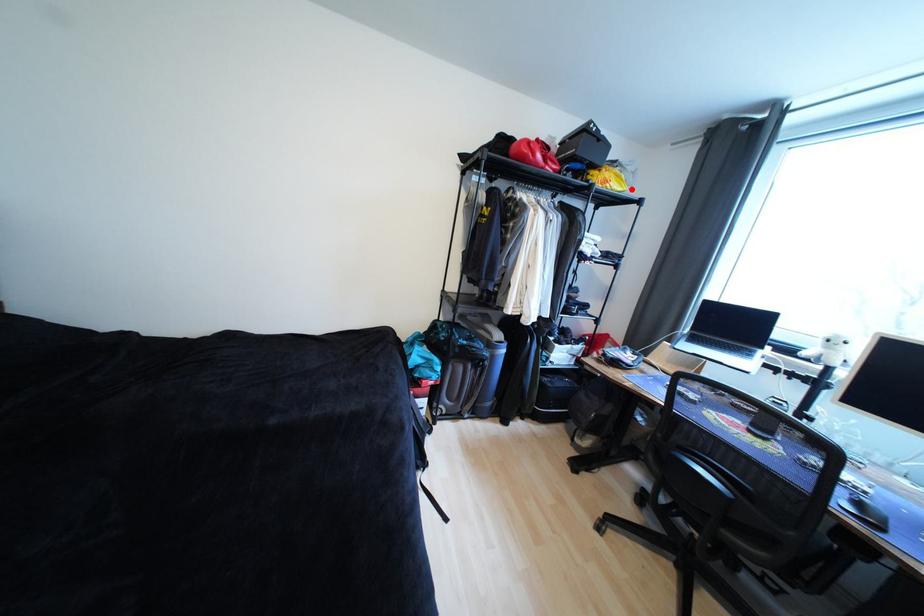
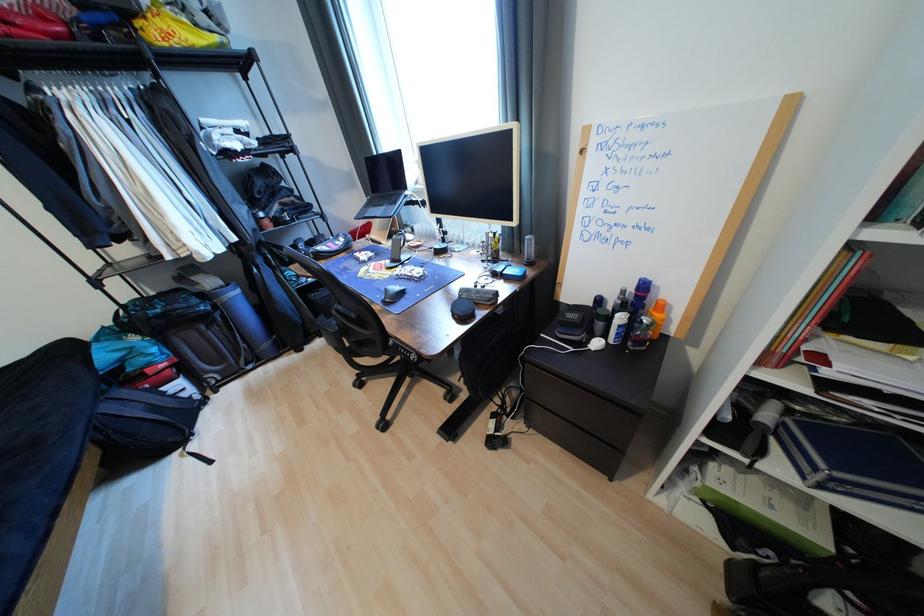
Question: A red point is marked in image1. In image2, is the corresponding 3D point closer to the camera or farther? Reply with the corresponding letter.

Choices:
 (A) The corresponding 3D point is closer.
 (B) The corresponding 3D point is farther.

Answer: (B)